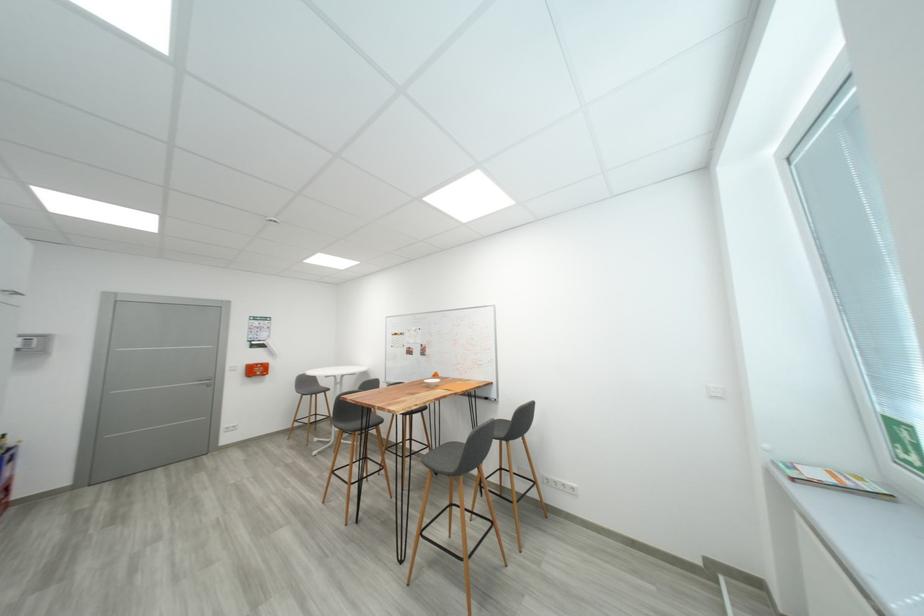
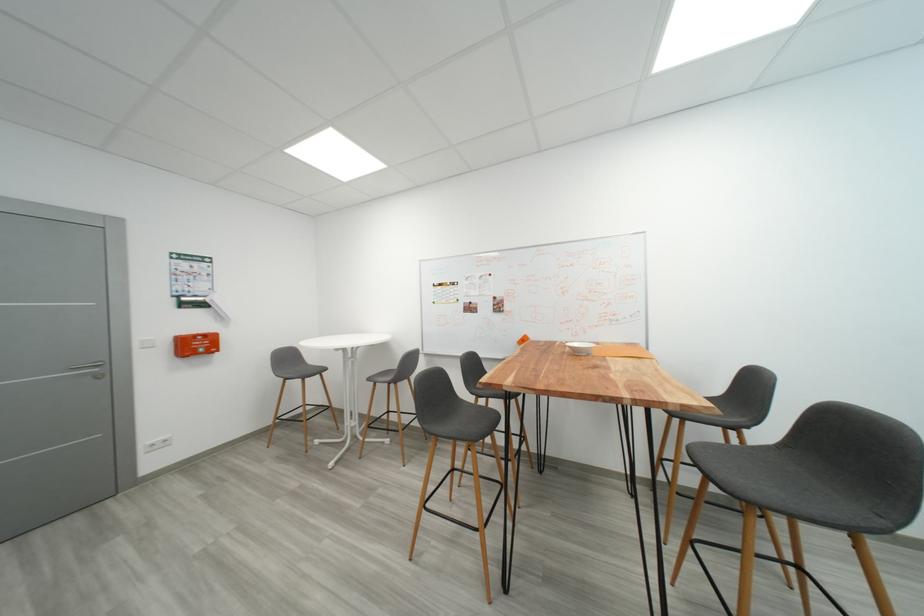
The images are taken continuously from a first-person perspective. In which direction are you moving?

The cameraman walked toward left, forward.